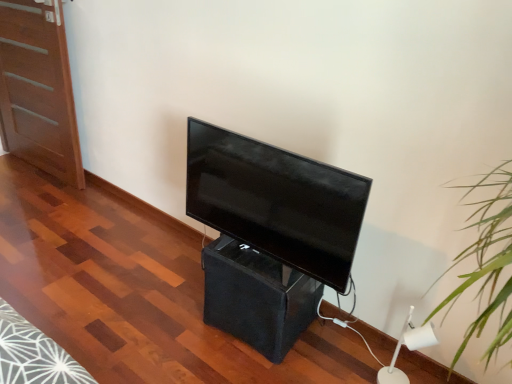
Image resolution: width=512 pixels, height=384 pixels. I want to click on vacant region below matte wood door at left (from a real-world perspective), so click(x=37, y=169).